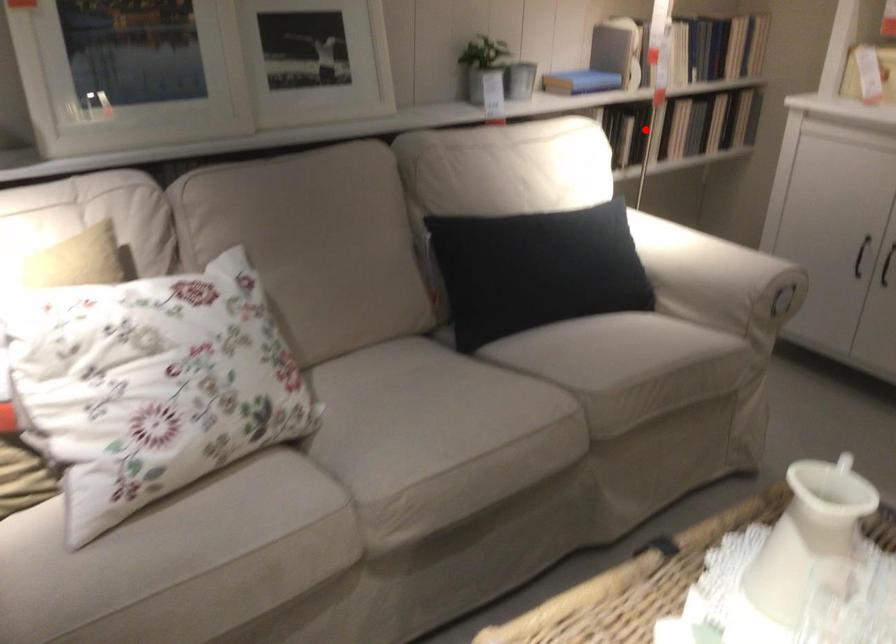
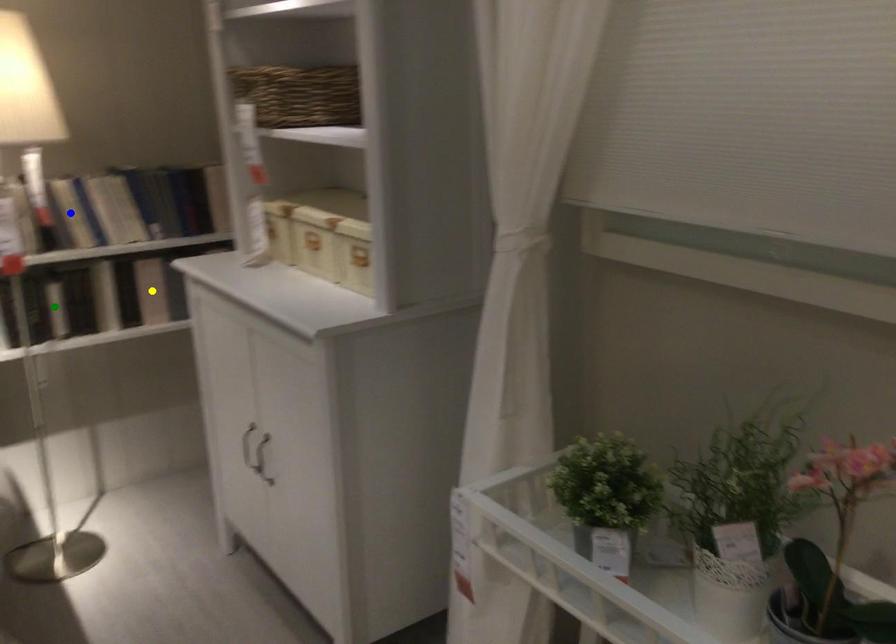
Question: I am providing you with two images of the same scene from different viewpoints. A red point is marked on the first image. You are given multiple points on the second image. Which mark in image 2 goes with the point in image 1?

Choices:
 (A) blue point
 (B) yellow point
 (C) green point

Answer: (C)